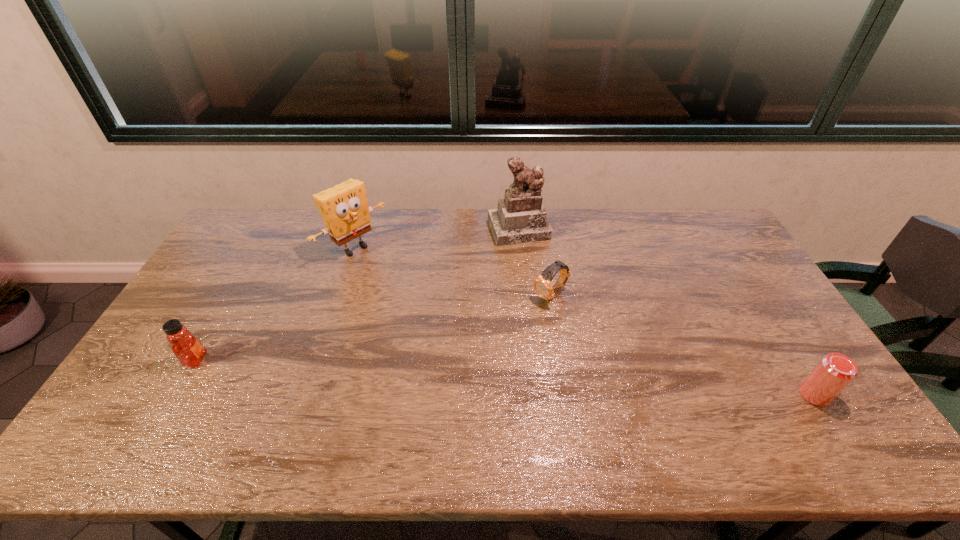
Locate an element on the screen. The image size is (960, 540). sponge present at the far edge is located at coordinates (344, 208).

Find the location of `object that is at the near edge`. object that is at the near edge is located at coordinates (835, 371).

At what (x,y) coordinates should I click in order to perform the action: click on object located in the left edge section of the desktop. Please return your answer as a coordinate pair (x, y). The height and width of the screenshot is (540, 960). Looking at the image, I should click on (189, 351).

Find the location of `object situated at the right edge`. object situated at the right edge is located at coordinates (835, 371).

Locate an element on the screen. object that is at the near right corner is located at coordinates (835, 371).

Where is `vacant space at the far edge of the desktop`? vacant space at the far edge of the desktop is located at coordinates (435, 237).

This screenshot has width=960, height=540. In the image, there is a desktop. Identify the location of vacant space at the near edge. (340, 402).

The image size is (960, 540). What are the coordinates of `free space at the left edge of the desktop` in the screenshot? It's located at (213, 265).

You are a GUI agent. You are given a task and a screenshot of the screen. Output one action in this format:
    pyautogui.click(x=<x>, y=<y>)
    Task: Click on the vacant space at the right edge of the desktop
    
    Given the screenshot: What is the action you would take?
    pyautogui.click(x=773, y=313)

Find the location of a particular element. vacant region at the far right corner of the desktop is located at coordinates (702, 225).